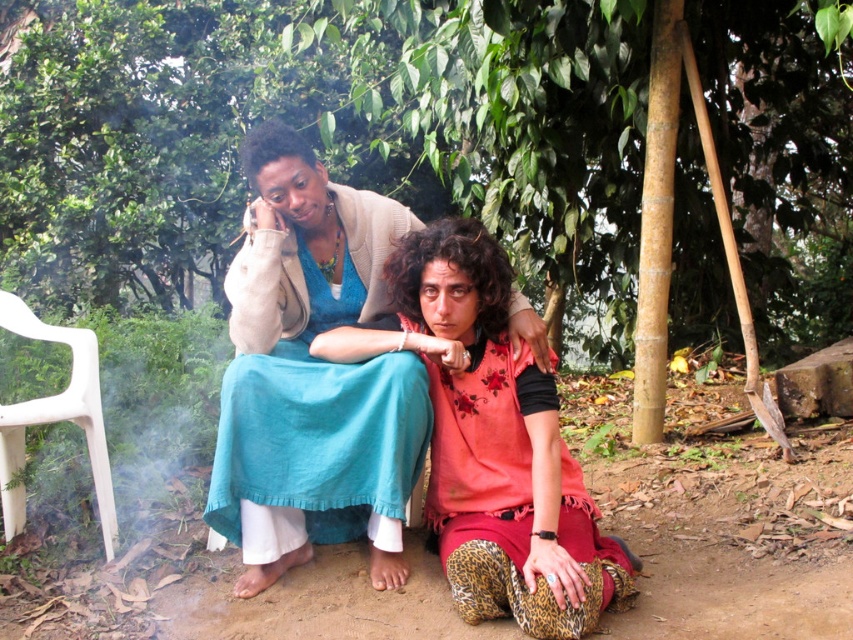
Please provide the 2D coordinates of the floral fabric dress at center in the image.

The 2D coordinates of the floral fabric dress at center are at point (492,442).

You are planning to install a bird feeder in the garden. The bird feeder requires a sturdy branch that is at least 1.5 meters tall. Based on the scene, which object between the green leafy tree at upper center and the white plastic chair at left would be suitable for installing the bird feeder?

The green leafy tree at upper center has a lesser height compared to the white plastic chair at left. Since the bird feeder requires a branch at least 1.5 meters tall, the white plastic chair at left is taller and would be suitable for installing the bird feeder.